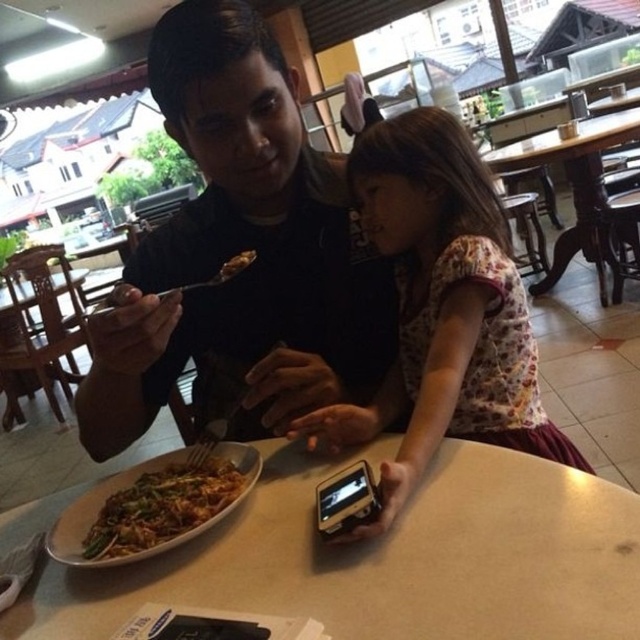
Does point (339, 448) come in front of point (236, 272)?

Yes.

Which is more to the left, floral fabric shirt at center or brown matte food at upper center?

brown matte food at upper center is more to the left.

The width and height of the screenshot is (640, 640). Find the location of `floral fabric shirt at center`. floral fabric shirt at center is located at coordinates (442, 308).

In the scene shown: Who is positioned more to the left, white matte table at center or wooden table at center?

From the viewer's perspective, white matte table at center appears more on the left side.

Which of these two, white matte table at center or wooden table at center, stands taller?

wooden table at center

At what (x,y) coordinates should I click in order to perform the action: click on white matte table at center. Please return your answer as a coordinate pair (x, y). Looking at the image, I should click on (388, 557).

Is the position of matte black shirt at center less distant than that of brown matte food at upper center?

Yes, it is.

Looking at this image, can you confirm if matte black shirt at center is wider than brown matte food at upper center?

Yes, matte black shirt at center is wider than brown matte food at upper center.

Is point (168, 244) positioned before point (241, 253)?

No.

Identify the location of matte black shirt at center. The width and height of the screenshot is (640, 640). (237, 252).